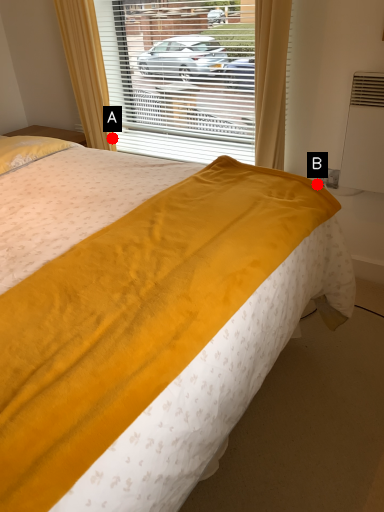
Question: Two points are circled on the image, labeled by A and B beside each circle. Which point appears farthest from the camera in this image?

Choices:
 (A) A is further
 (B) B is further

Answer: (A)